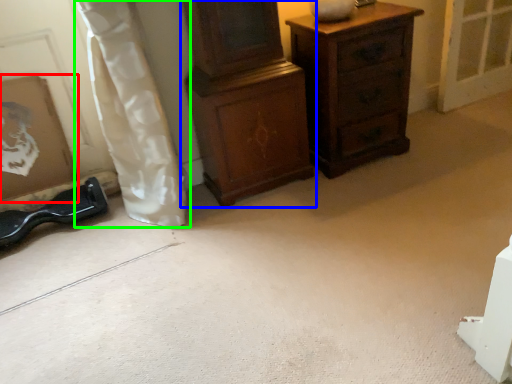
Question: Which object is the farthest from picture frame (highlighted by a red box)? Choose among these: chest of drawers (highlighted by a blue box) or curtain (highlighted by a green box).

Choices:
 (A) chest of drawers
 (B) curtain

Answer: (A)